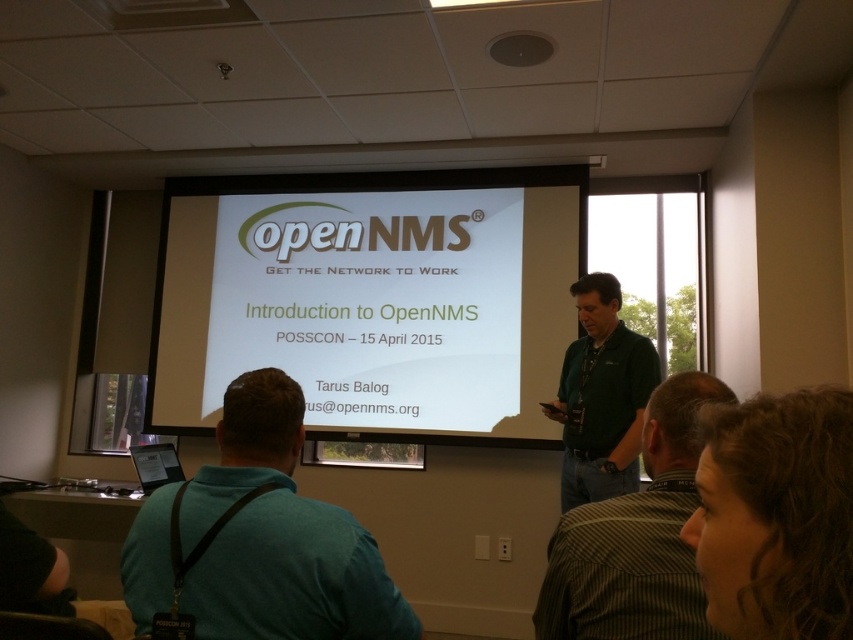
You are standing in the conference room and see two points marked on the projection screen. Which point is closer to you, point [679,612] or point [596,385]?

Point [679,612] is in front of point [596,385], so it is closer to you.

From the picture: You are an attendee at the presentation and want to take a photo of the white glossy projector screen at center and the green shirt at center. Which object should you focus on first if you want to capture both in a single frame without moving the camera?

The white glossy projector screen at center is larger in size than the green shirt at center, so you should focus on the white glossy projector screen at center first to ensure it fits properly in the frame before adjusting for the smaller green shirt at center.

You are standing at the point marked as point (355,246) in the conference room. The projection screen is 14.44 feet away from you. Can you estimate whether you are closer to the screen or the exit door located at the back of the room?

The distance between you and the projection screen is 14.44 feet. Since the exit door is at the back of the room, which is likely farther away than the screen, you are closer to the projection screen.